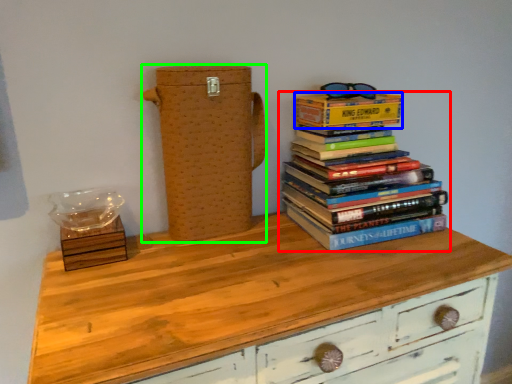
Question: Which is farther away from book (highlighted by a red box)? paperback book (highlighted by a blue box) or cardboard box (highlighted by a green box)?

Choices:
 (A) paperback book
 (B) cardboard box

Answer: (B)